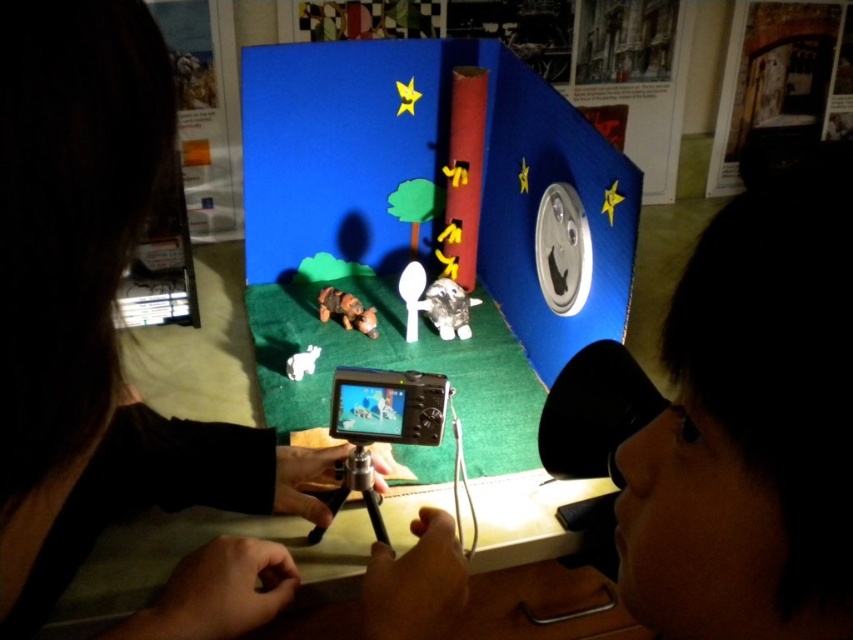
I want to click on black matte camera at center, so click(94, 307).

From the picture: Is black matte camera at center below matte plastic video game at center?

No, black matte camera at center is not below matte plastic video game at center.

Locate an element on the screen. The image size is (853, 640). black matte camera at center is located at coordinates (94, 307).

You are a GUI agent. You are given a task and a screenshot of the screen. Output one action in this format:
    pyautogui.click(x=<x>, y=<y>)
    Task: Click on the black matte camera at center
    The width and height of the screenshot is (853, 640).
    Given the screenshot: What is the action you would take?
    pyautogui.click(x=94, y=307)